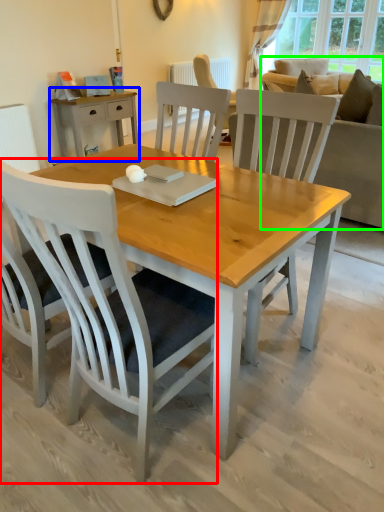
Question: Based on their relative distances, which object is farther from chair (highlighted by a red box)? Choose from desk (highlighted by a blue box) and studio couch (highlighted by a green box).

Choices:
 (A) desk
 (B) studio couch

Answer: (A)